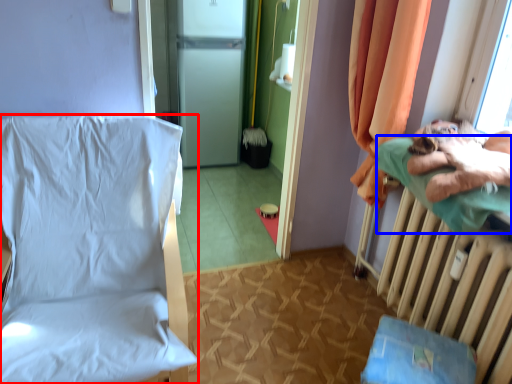
Question: Which of the following is the farthest to the observer, furniture (highlighted by a red box) or pillow (highlighted by a blue box)?

Choices:
 (A) furniture
 (B) pillow

Answer: (B)